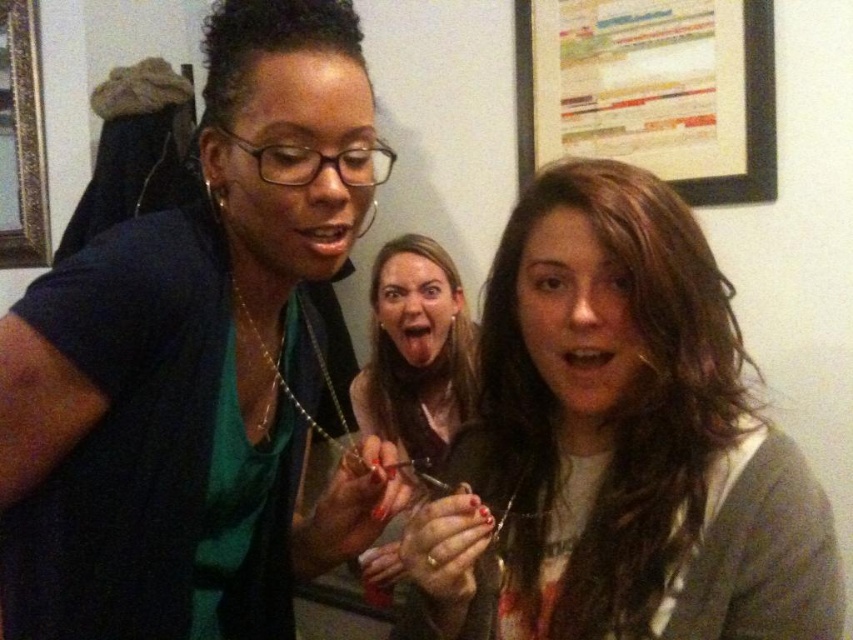
Which is above, matte black shirt at center or matte black scissors at center?

matte black shirt at center is above.

Can you confirm if matte black shirt at center is thinner than matte black scissors at center?

In fact, matte black shirt at center might be wider than matte black scissors at center.

Measure the distance between point (175, 310) and camera.

The distance of point (175, 310) from camera is 71.21 centimeters.

I want to click on matte black shirt at center, so click(196, 365).

Does matte black shirt at center appear on the left side of gold ornate picture frame at upper left?

No, matte black shirt at center is not to the left of gold ornate picture frame at upper left.

Is point (283, 97) positioned behind point (21, 148)?

No, (283, 97) is closer to viewer.

The height and width of the screenshot is (640, 853). What are the coordinates of `matte black shirt at center` in the screenshot? It's located at (196, 365).

In the scene shown: Is matte black shirt at center shorter than matte brown hair at center?

In fact, matte black shirt at center may be taller than matte brown hair at center.

Based on the photo, how far apart are matte black shirt at center and matte brown hair at center?

8.99 inches

Is point (254, 477) farther from viewer compared to point (514, 520)?

Yes, it is.

This screenshot has height=640, width=853. In order to click on matte black shirt at center in this screenshot , I will do `click(196, 365)`.